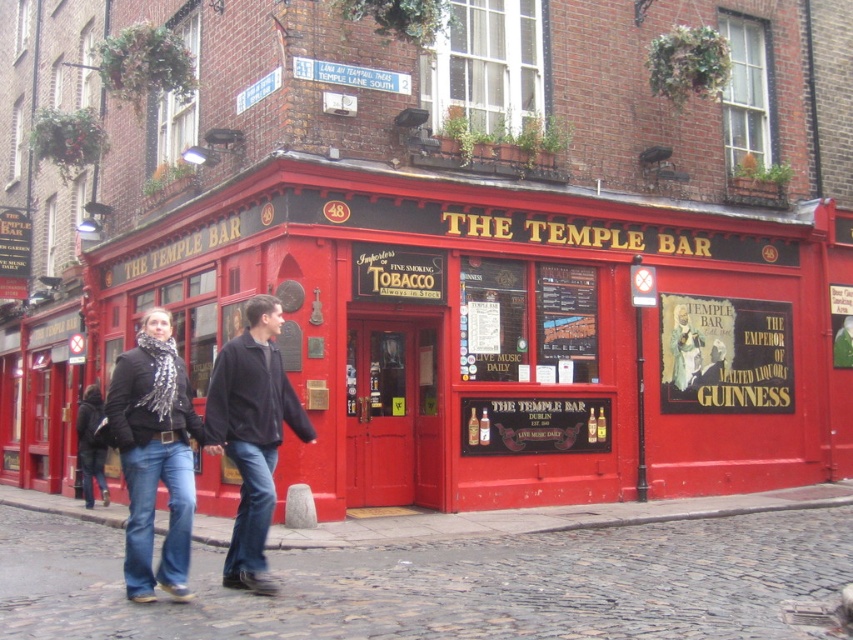
Question: Which point is farther to the camera?

Choices:
 (A) (57, 536)
 (B) (256, 380)
 (C) (256, 381)

Answer: (A)

Question: Does black leather jacket at lower left appear on the left side of jeans at lower left?

Choices:
 (A) no
 (B) yes

Answer: (B)

Question: Can you confirm if denim jeans at lower left is positioned to the right of black matte jacket at lower left?

Choices:
 (A) no
 (B) yes

Answer: (B)

Question: Which point is closer to the camera?

Choices:
 (A) black suede jacket at center
 (B) red matte pub at center
 (C) blue denim jeans at lower left

Answer: (C)

Question: Which of the following is the farthest from the observer?

Choices:
 (A) (161, 424)
 (B) (521, 188)
 (C) (239, 460)
 (D) (86, 458)

Answer: (D)

Question: Where is black matte jacket at lower left located in relation to blue denim jeans at lower center in the image?

Choices:
 (A) above
 (B) below

Answer: (A)